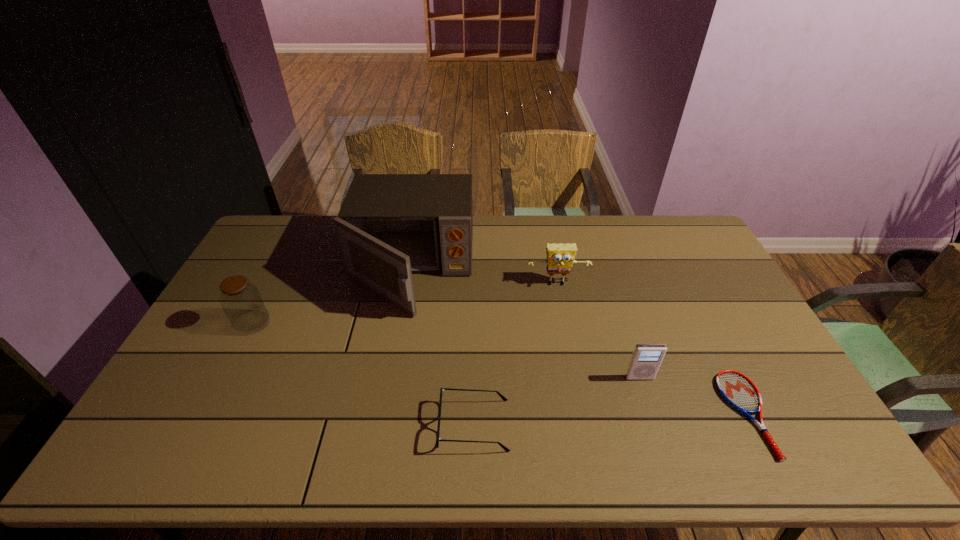
Find the location of a particular element. This screenshot has height=540, width=960. vacant space at the near edge of the desktop is located at coordinates (217, 439).

You are a GUI agent. You are given a task and a screenshot of the screen. Output one action in this format:
    pyautogui.click(x=<x>, y=<y>)
    Task: Click on the vacant region at the left edge of the desktop
    
    Given the screenshot: What is the action you would take?
    pyautogui.click(x=171, y=389)

Identify the location of vacant area at the right edge. (745, 314).

I want to click on free spot between the spectacles and the sponge, so click(x=516, y=355).

The image size is (960, 540). I want to click on free spot between the iPod and the sponge, so click(598, 331).

In order to click on unoccupied area between the tallest object and the fifth object from left to right in this screenshot , I will do `click(525, 323)`.

Identify the location of free space between the leftmost object and the tennis racket. (500, 368).

The height and width of the screenshot is (540, 960). In order to click on free space between the leftmost object and the tallest object in this screenshot , I will do `click(331, 296)`.

Image resolution: width=960 pixels, height=540 pixels. I want to click on free spot between the iPod and the jar, so click(446, 350).

Image resolution: width=960 pixels, height=540 pixels. In order to click on vacant area between the second shortest object and the sponge in this screenshot , I will do `click(516, 355)`.